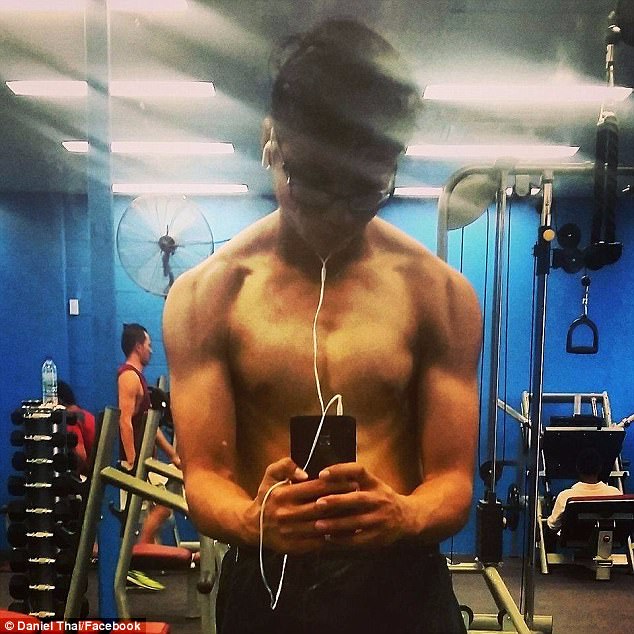
You are a GUI agent. You are given a task and a screenshot of the screen. Output one action in this format:
    pyautogui.click(x=<x>, y=<y>)
    Task: Click on the gray ceiling with lights
    This screenshot has height=634, width=634.
    Given the screenshot: What is the action you would take?
    pyautogui.click(x=35, y=167), pyautogui.click(x=169, y=148), pyautogui.click(x=156, y=89), pyautogui.click(x=495, y=149), pyautogui.click(x=432, y=190), pyautogui.click(x=482, y=89)